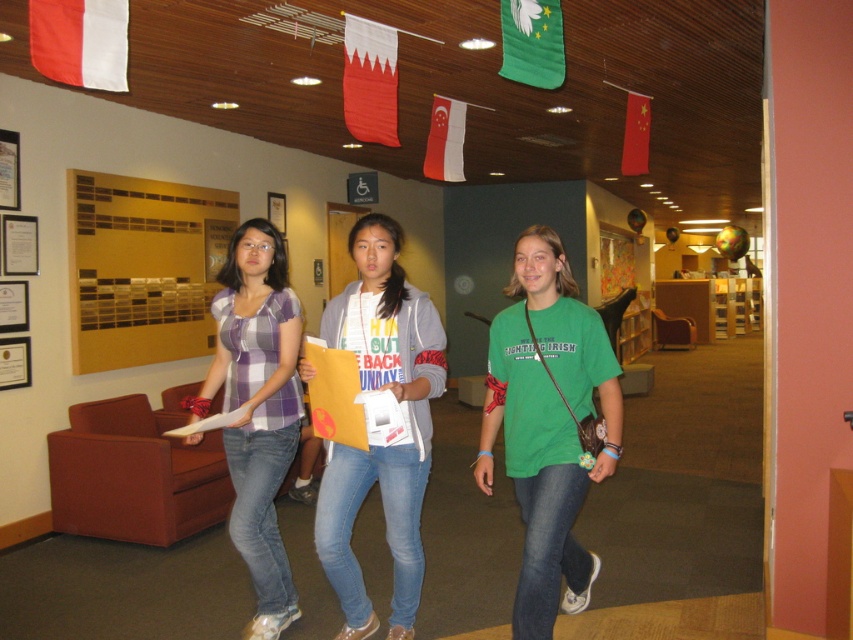
Question: Which of the following is the farthest from the observer?

Choices:
 (A) (409, 508)
 (B) (93, 244)
 (C) (589, 369)
 (D) (273, 630)

Answer: (B)

Question: Can you confirm if gold metallic bulletin board at upper left is positioned to the left of plaid fabric shirt at center?

Choices:
 (A) no
 (B) yes

Answer: (B)

Question: In this image, where is green matte t-shirt at center located relative to plaid fabric shirt at center?

Choices:
 (A) above
 (B) below

Answer: (B)

Question: Which object is farther from the camera taking this photo?

Choices:
 (A) plaid fabric shirt at center
 (B) green matte t-shirt at center
 (C) gold metallic bulletin board at upper left

Answer: (C)

Question: Does gold metallic bulletin board at upper left have a lesser width compared to plaid fabric shirt at center?

Choices:
 (A) no
 (B) yes

Answer: (A)

Question: Among these points, which one is farthest from the camera?

Choices:
 (A) (213, 260)
 (B) (521, 476)
 (C) (241, 492)
 (D) (386, 344)

Answer: (A)